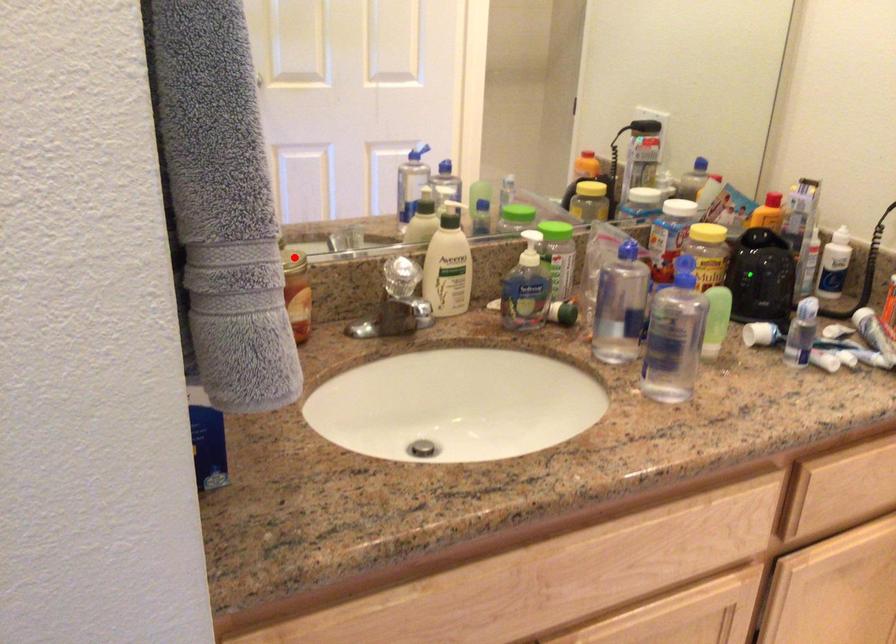
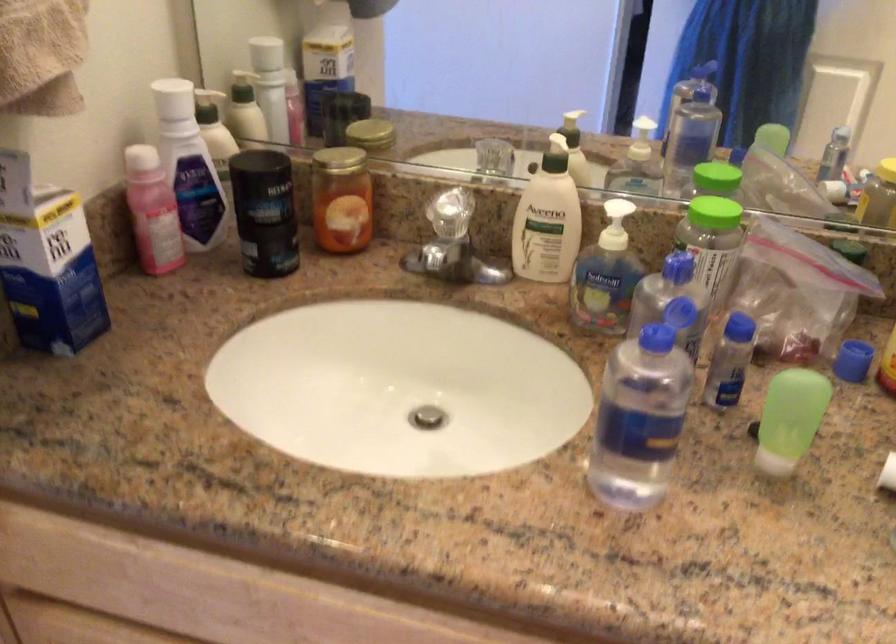
Question: I am providing you with two images of the same scene from different viewpoints. In image1, a red point is highlighted. Considering the same 3D point in image2, which of the following is correct?

Choices:
 (A) It is closer
 (B) It is farther

Answer: (A)